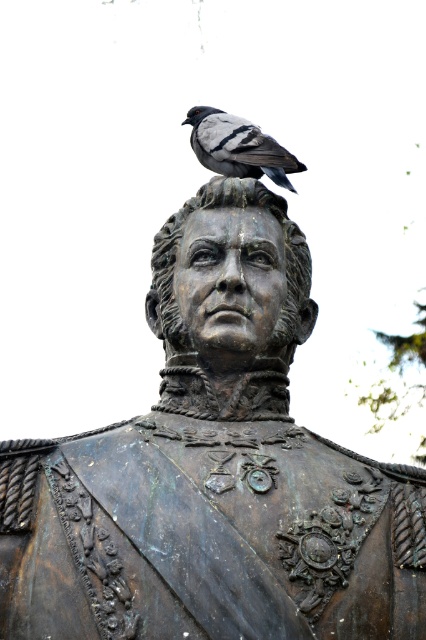
Question: Does bronze statue head at center appear over gray feathered pigeon at center?

Choices:
 (A) no
 (B) yes

Answer: (A)

Question: Based on their relative distances, which object is farther from the bronze statue at upper center?

Choices:
 (A) bronze statue head at center
 (B) gray feathered pigeon at center

Answer: (B)

Question: Is bronze statue head at center further to the viewer compared to gray feathered pigeon at center?

Choices:
 (A) no
 (B) yes

Answer: (A)

Question: Is bronze statue at upper center thinner than bronze statue head at center?

Choices:
 (A) yes
 (B) no

Answer: (B)

Question: Which of these objects is positioned closest to the gray feathered pigeon at center?

Choices:
 (A) bronze statue at upper center
 (B) bronze statue head at center

Answer: (B)

Question: Which object is positioned farthest from the gray feathered pigeon at center?

Choices:
 (A) bronze statue head at center
 (B) bronze statue at upper center

Answer: (B)